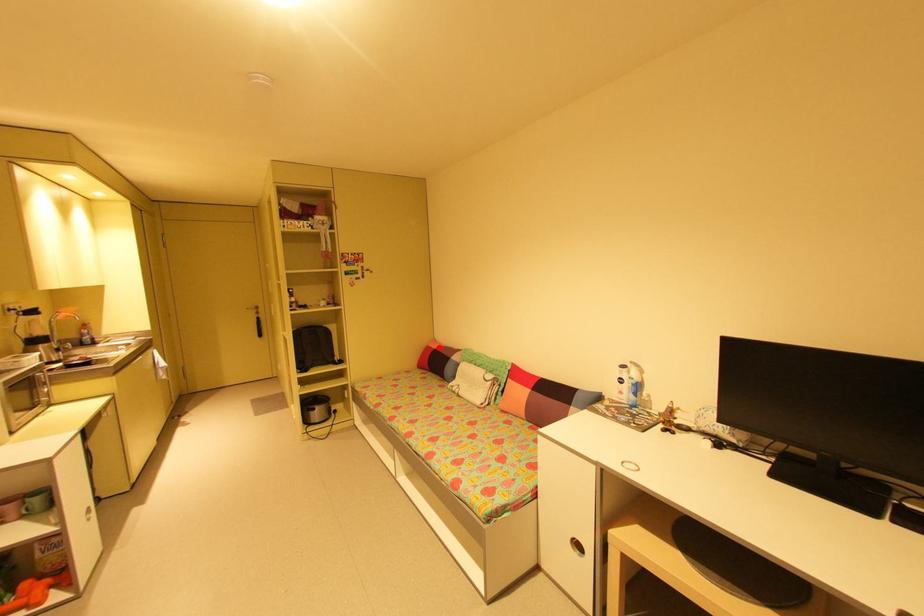
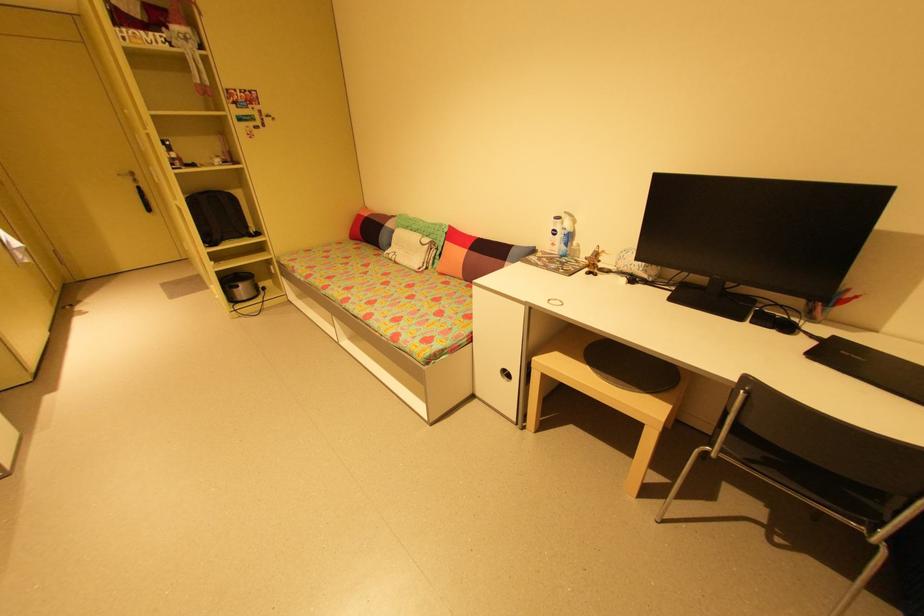
Question: A red point is marked in image1. In image2, is the corresponding 3D point closer to the camera or farther? Reply with the corresponding letter.

Choices:
 (A) The corresponding 3D point is closer.
 (B) The corresponding 3D point is farther.

Answer: (A)